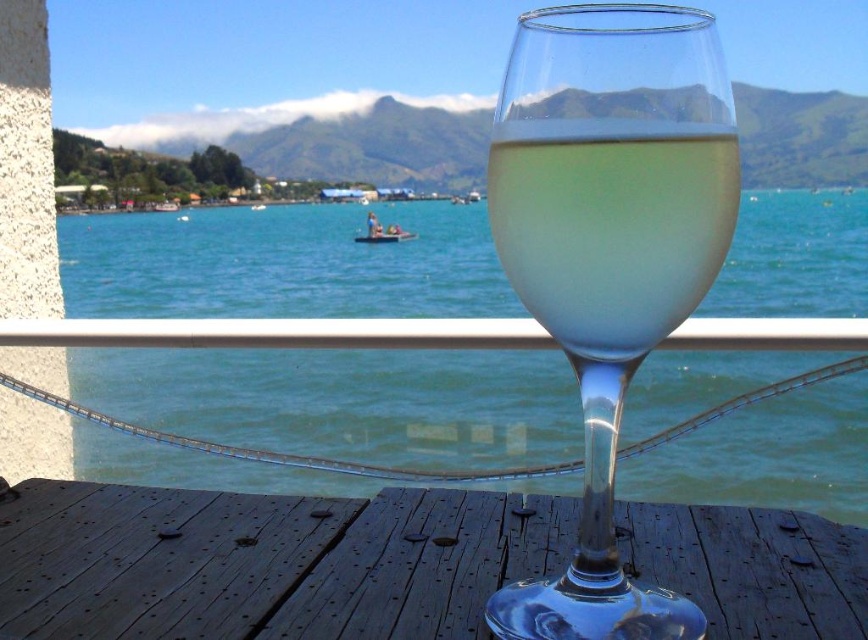
You are holding a small toy boat that you want to place on the water. Based on the scene, where should you place it so that it floats on the transparent water at center and not inside the clear glass wine glass at center?

You should place the toy boat on the transparent water at center, which is above the clear glass wine glass at center, ensuring it floats on the water and not inside the glass.

You are a photographer trying to capture the entire scene in one shot. Given that the transparent water at center and the translucent glass wine at center are both in focus, which object takes up more space in the photo?

The transparent water at center takes up more space in the photo because it is larger in size than the translucent glass wine at center.

Based on the photo, you are a photographer trying to capture the entire scene in one shot. Given that the transparent water at center and the translucent glass wine at center are both in the frame, which object will occupy more horizontal space in the photo?

The transparent water at center will occupy more horizontal space in the photo because its width is larger than that of the translucent glass wine at center.